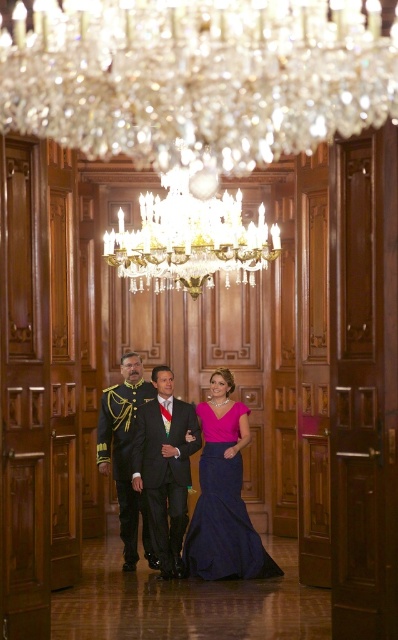
You are standing in the grand hall and notice two points marked on the wall. The first point is at coordinate point [169,502] and the second is at point [195,516]. Which point is closer to you?

Point [169,502] is closer to you because it is further to the camera than point [195,516].